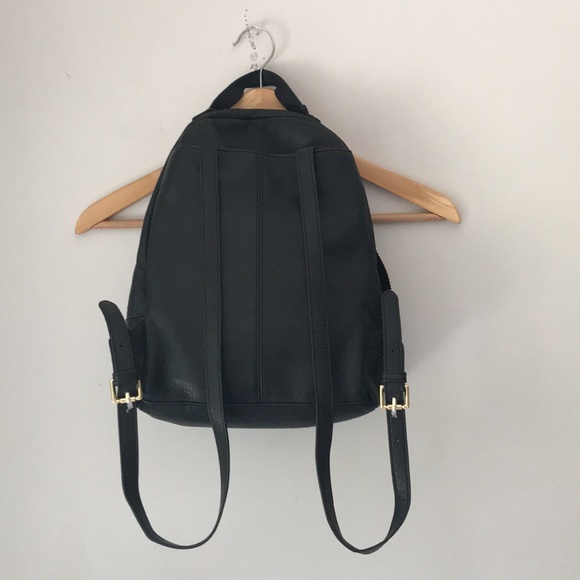
Find the location of a particular element. white wall is located at coordinates (512, 379).